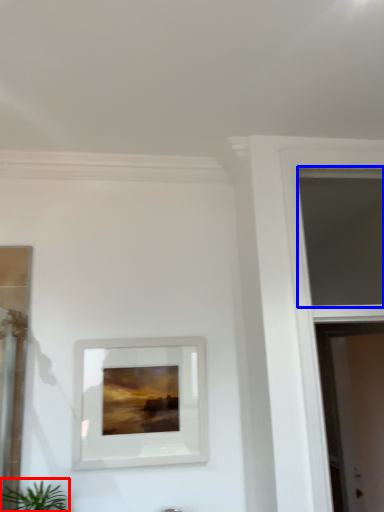
Question: Which of the following is the farthest to the observer, houseplant (highlighted by a red box) or window (highlighted by a blue box)?

Choices:
 (A) houseplant
 (B) window

Answer: (B)